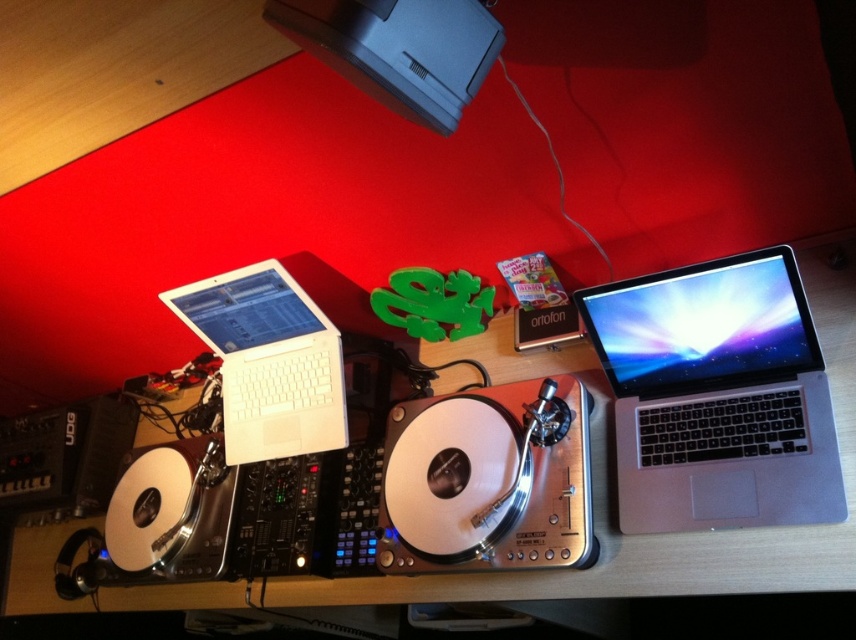
Question: Is wooden table at center to the left of white matte laptop at left from the viewer's perspective?

Choices:
 (A) yes
 (B) no

Answer: (B)

Question: Which point appears closest to the camera in this image?

Choices:
 (A) (563, 572)
 (B) (227, 300)

Answer: (A)

Question: Which point appears farthest from the camera in this image?

Choices:
 (A) (241, 461)
 (B) (96, 426)
 (C) (669, 344)
 (D) (55, 547)

Answer: (D)

Question: Considering the relative positions of wooden table at center and black plastic speaker at lower left in the image provided, where is wooden table at center located with respect to black plastic speaker at lower left?

Choices:
 (A) below
 (B) above

Answer: (A)

Question: Is silver metallic laptop at right positioned at the back of black plastic speaker at lower left?

Choices:
 (A) no
 (B) yes

Answer: (A)

Question: Which point is closer to the camera?

Choices:
 (A) white matte laptop at left
 (B) wooden table at center
 (C) black plastic speaker at lower left
 (D) silver metallic laptop at right

Answer: (D)